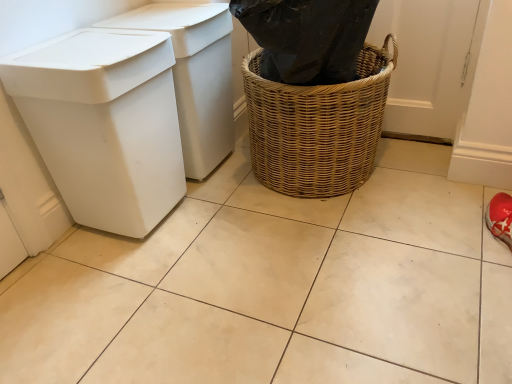
Locate an element on the screen. The height and width of the screenshot is (384, 512). vacant space in front of white plastic bin at left, which is the 2th waste container in back-to-front order is located at coordinates (115, 284).